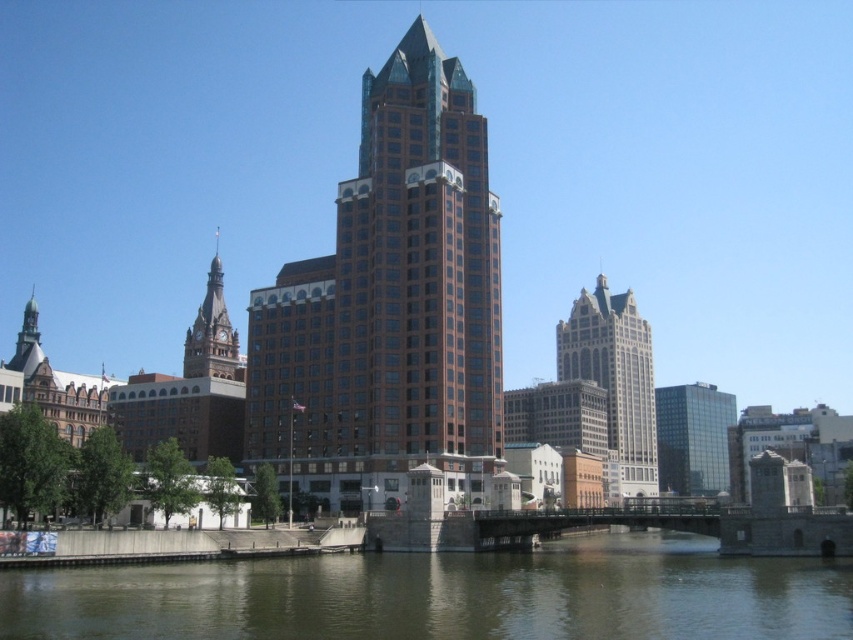
Question: Does brown murky water at lower center appear over glassy reflective building at right?

Choices:
 (A) no
 (B) yes

Answer: (B)

Question: Which object appears farthest from the camera in this image?

Choices:
 (A) brown murky water at lower center
 (B) gray stone building at center
 (C) glassy reflective building at right

Answer: (C)

Question: Does brown murky water at lower center lie behind gray stone building at center?

Choices:
 (A) yes
 (B) no

Answer: (B)

Question: Is brown murky water at lower center further to the viewer compared to gray stone building at center?

Choices:
 (A) yes
 (B) no

Answer: (B)

Question: Among these points, which one is farthest from the camera?

Choices:
 (A) (641, 560)
 (B) (227, 340)

Answer: (B)

Question: Estimate the real-world distances between objects in this image. Which object is closer to the glassy reflective building at right?

Choices:
 (A) brown glassy building at center
 (B) brick steeple at left
 (C) brown murky water at lower center

Answer: (B)